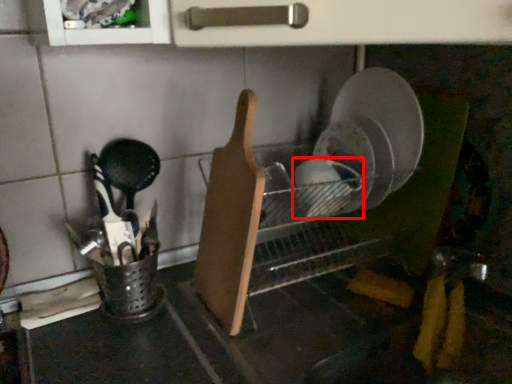
Question: From the image's perspective, what is the correct spatial relationship of tableware (annotated by the red box) in relation to cutting board?

Choices:
 (A) above
 (B) below

Answer: (A)